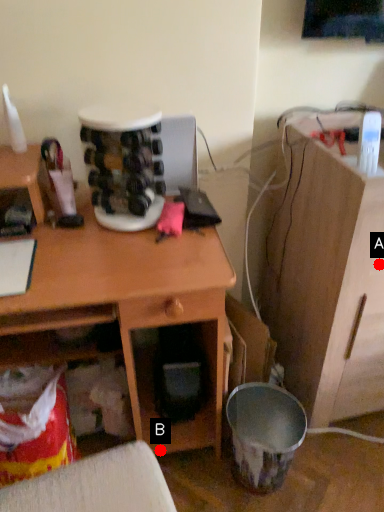
Question: Two points are circled on the image, labeled by A and B beside each circle. Which point is closer to the camera?

Choices:
 (A) A is closer
 (B) B is closer

Answer: (A)